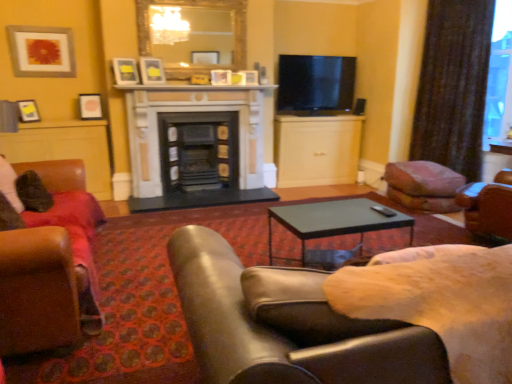
Question: In which direction should I rotate to look at black matte fireplace at center, which is the second fireplace in right-to-left order?

Choices:
 (A) right
 (B) left

Answer: (B)

Question: Does brown leather chair at center, placed as the 2th chair when sorted from left to right, touch matte black picture frame at upper center, which is counted as the third picture frame, starting from the left?

Choices:
 (A) yes
 (B) no

Answer: (B)

Question: Can you confirm if brown leather chair at center, placed as the 2th chair when sorted from left to right, is smaller than matte black picture frame at upper center, which is the second picture frame from right to left?

Choices:
 (A) yes
 (B) no

Answer: (B)

Question: Is brown leather chair at center, placed as the 2th chair when sorted from left to right, not near matte black picture frame at upper center, which is the second picture frame from right to left?

Choices:
 (A) no
 (B) yes

Answer: (B)

Question: Does brown leather chair at center, which ranks as the first chair in right-to-left order, have a greater width compared to matte black picture frame at upper center, which is the second picture frame from right to left?

Choices:
 (A) yes
 (B) no

Answer: (A)

Question: Does brown leather chair at center, placed as the 2th chair when sorted from left to right, appear on the right side of matte black picture frame at upper center, which is the second picture frame from right to left?

Choices:
 (A) yes
 (B) no

Answer: (A)

Question: From a real-world perspective, does brown leather chair at center, which ranks as the first chair in right-to-left order, stand above matte black picture frame at upper center, which is the second picture frame from right to left?

Choices:
 (A) no
 (B) yes

Answer: (A)

Question: From the image's perspective, does brown leather chair at left, acting as the second chair starting from the right, appear lower than brown leather chair at center, placed as the 2th chair when sorted from left to right?

Choices:
 (A) yes
 (B) no

Answer: (B)

Question: Considering the relative sizes of brown leather chair at left, the first chair from the left, and brown leather chair at center, placed as the 2th chair when sorted from left to right, in the image provided, is brown leather chair at left, the first chair from the left, bigger than brown leather chair at center, placed as the 2th chair when sorted from left to right,?

Choices:
 (A) yes
 (B) no

Answer: (B)

Question: Is brown leather chair at center, placed as the 2th chair when sorted from left to right, at the back of brown leather chair at left, acting as the second chair starting from the right?

Choices:
 (A) no
 (B) yes

Answer: (A)

Question: Is brown leather chair at left, the first chair from the left, not within brown leather chair at center, which ranks as the first chair in right-to-left order?

Choices:
 (A) no
 (B) yes

Answer: (B)

Question: Does brown leather chair at left, the first chair from the left, come in front of brown leather chair at center, placed as the 2th chair when sorted from left to right?

Choices:
 (A) yes
 (B) no

Answer: (B)

Question: Does brown leather chair at left, acting as the second chair starting from the right, have a greater width compared to brown leather chair at center, placed as the 2th chair when sorted from left to right?

Choices:
 (A) no
 (B) yes

Answer: (A)

Question: From a real-world perspective, is matte black coffee table at center below brown leather chair at center, placed as the 2th chair when sorted from left to right?

Choices:
 (A) yes
 (B) no

Answer: (A)